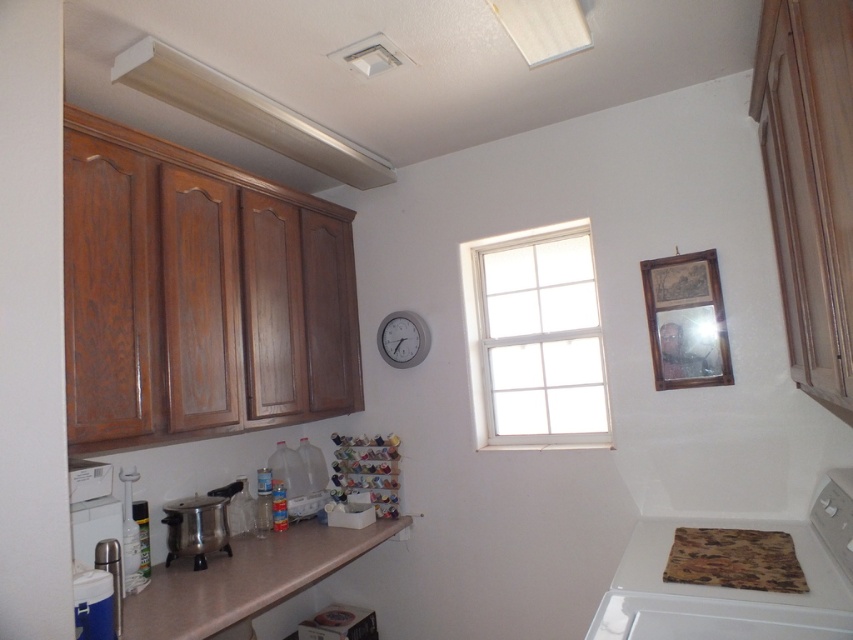
Does tan laminate counter top at lower center have a greater height compared to stainless steel pot at lower left?

In fact, tan laminate counter top at lower center may be shorter than stainless steel pot at lower left.

Which is in front, point (212, 608) or point (165, 561)?

Point (212, 608) is more forward.

Find the location of `tan laminate counter top at lower center`. tan laminate counter top at lower center is located at coordinates (245, 579).

You are a GUI agent. You are given a task and a screenshot of the screen. Output one action in this format:
    pyautogui.click(x=<x>, y=<y>)
    Task: Click on the tan laminate counter top at lower center
    The height and width of the screenshot is (640, 853).
    Given the screenshot: What is the action you would take?
    pyautogui.click(x=245, y=579)

What do you see at coordinates (245, 579) in the screenshot? This screenshot has height=640, width=853. I see `tan laminate counter top at lower center` at bounding box center [245, 579].

Where is `tan laminate counter top at lower center`? tan laminate counter top at lower center is located at coordinates [245, 579].

Between point (567, 436) and point (286, 557), which one is positioned in front?

Point (286, 557)

Which of these two, white glass window at center or tan laminate counter top at lower center, stands taller?

With more height is white glass window at center.

What do you see at coordinates (537, 337) in the screenshot?
I see `white glass window at center` at bounding box center [537, 337].

Identify the location of white glass window at center. This screenshot has width=853, height=640. (537, 337).